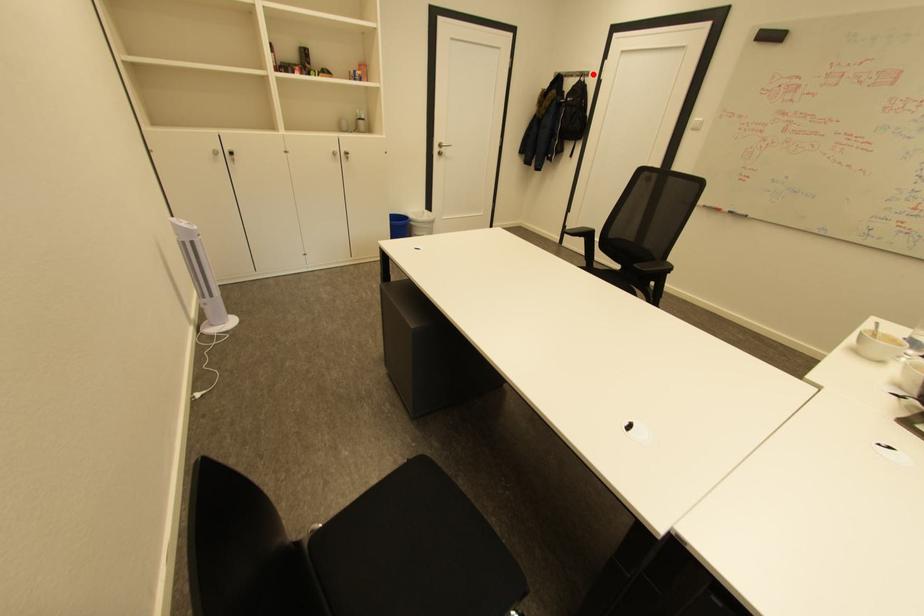
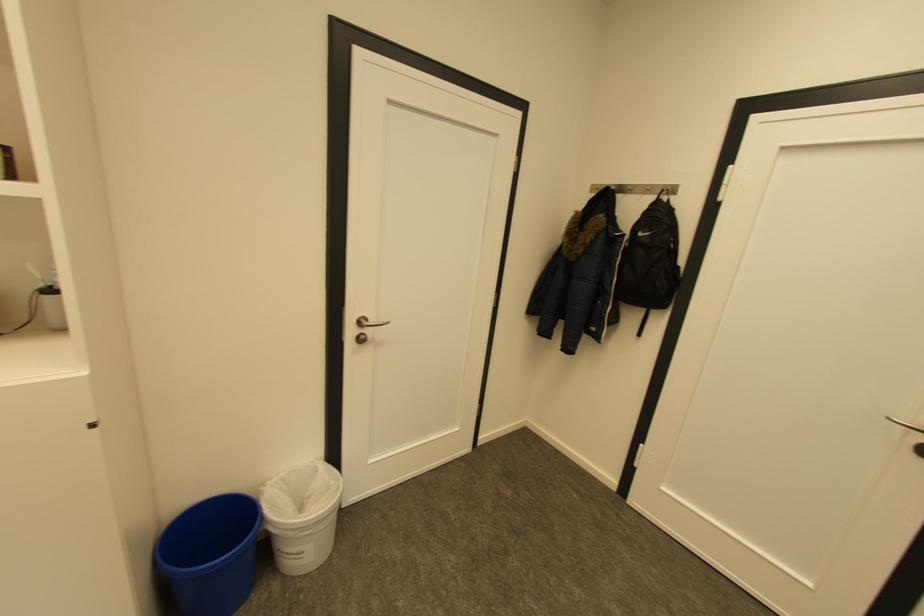
Locate, in the second image, the point that corresponds to the highlighted location in the first image.

(677, 190)